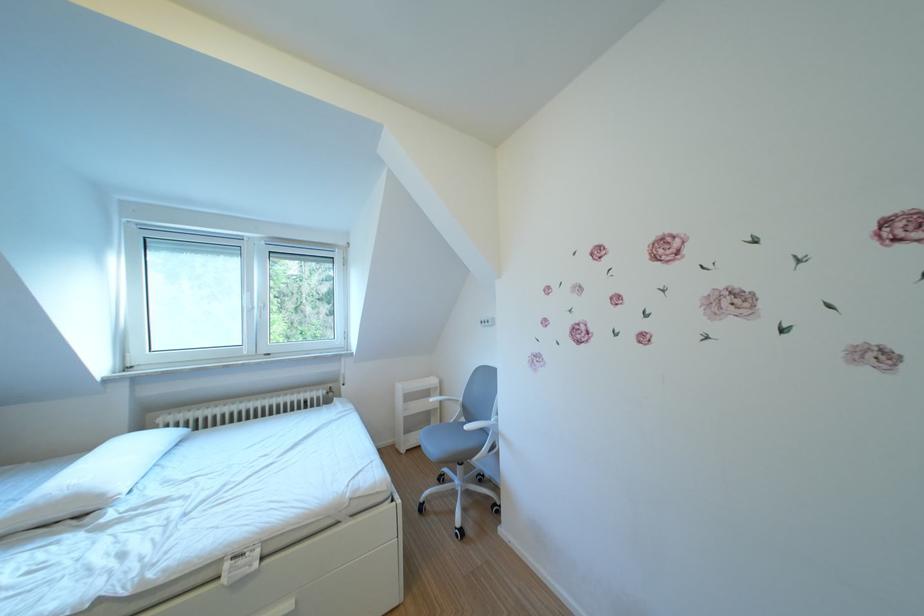
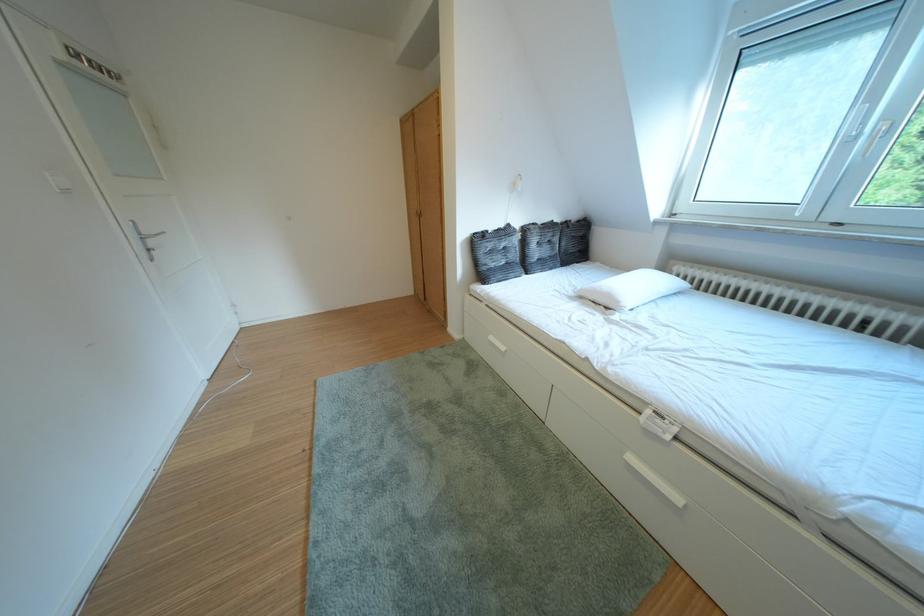
The images are taken continuously from a first-person perspective. In which direction is your viewpoint rotating?

The camera's rotation is toward left-down.